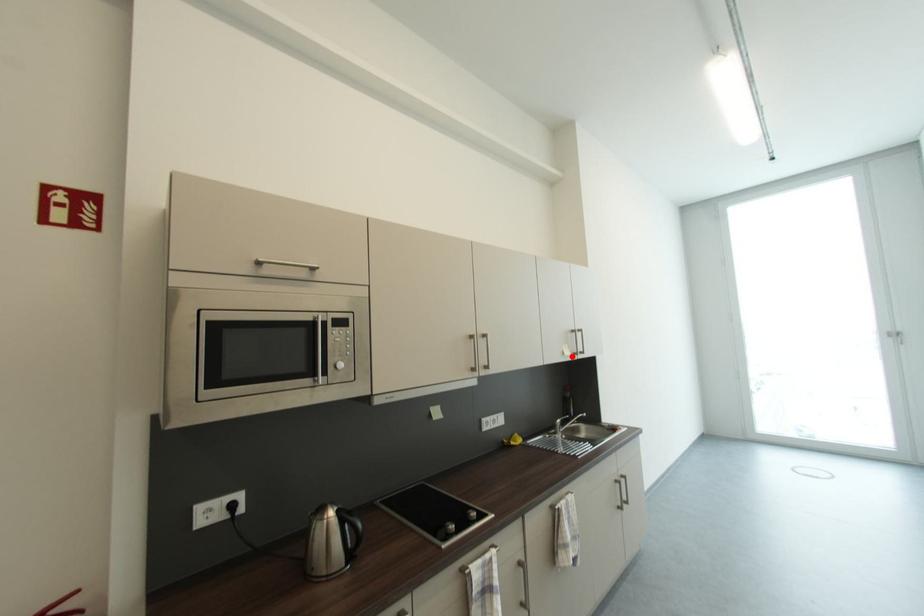
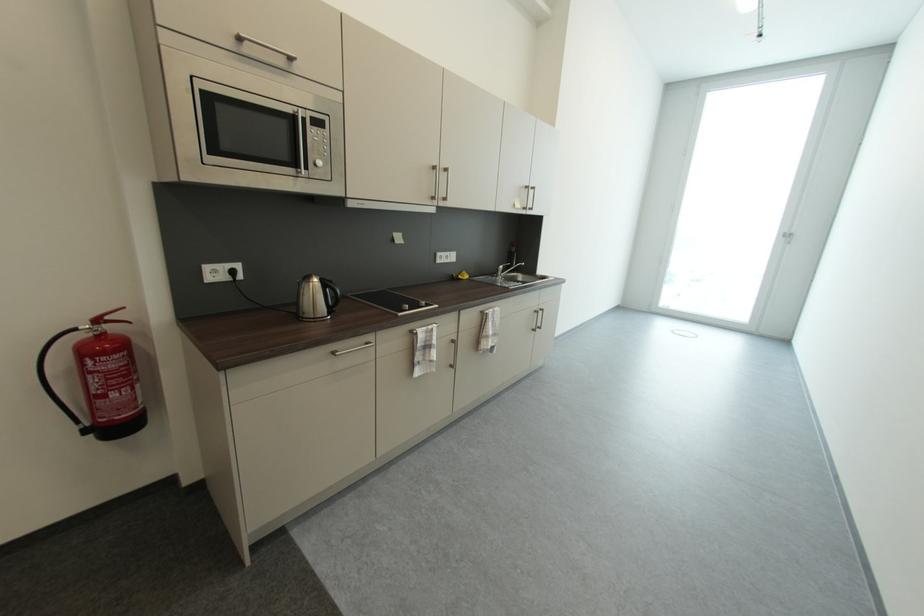
Find the pixel in the second image that matches the highlighted location in the first image.

(523, 209)